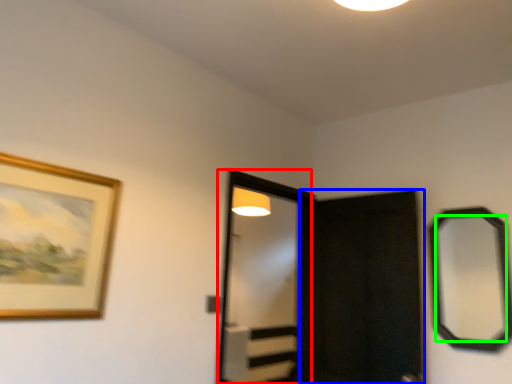
Question: Which is nearer to the screen door (highlighted by a red box)? screen door (highlighted by a blue box) or mirror (highlighted by a green box).

Choices:
 (A) screen door
 (B) mirror

Answer: (A)